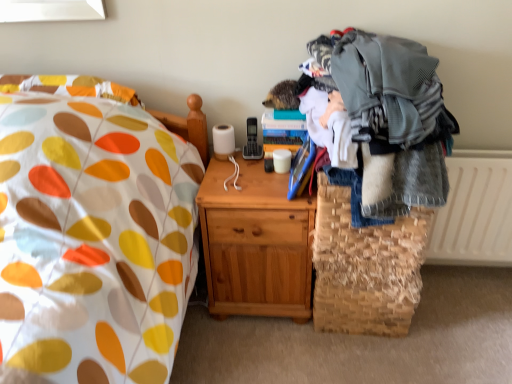
At what (x,y) coordinates should I click in order to perform the action: click on vacant space underneath white textured radiator at right (from a real-world perspective). Please return your answer as a coordinate pair (x, y). The width and height of the screenshot is (512, 384). Looking at the image, I should click on (461, 275).